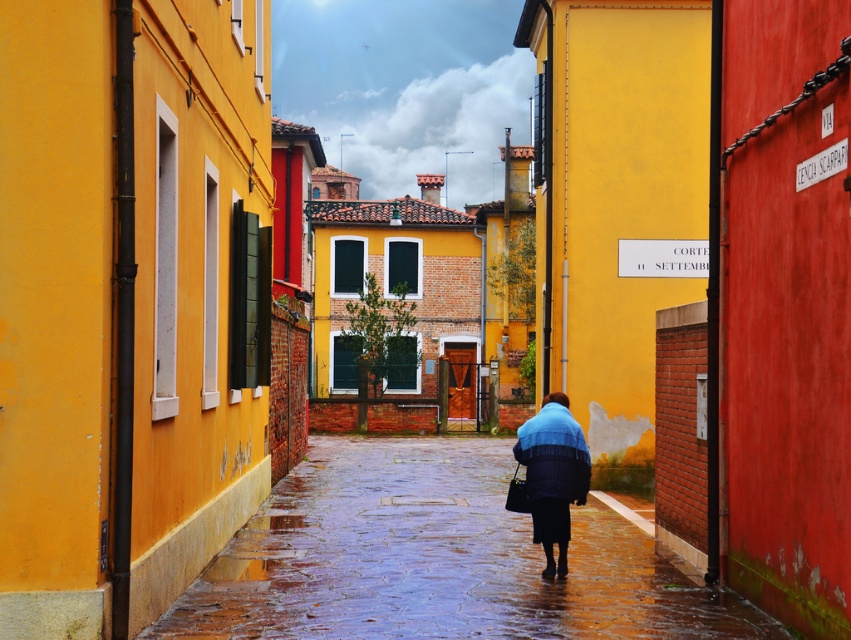
Question: Is the position of wet stone pavement at center less distant than that of blue fuzzy coat at center?

Choices:
 (A) yes
 (B) no

Answer: (A)

Question: Is wet stone pavement at center positioned behind blue fuzzy coat at center?

Choices:
 (A) yes
 (B) no

Answer: (B)

Question: Which point is closer to the camera?

Choices:
 (A) (587, 476)
 (B) (294, 634)

Answer: (B)

Question: Can you confirm if wet stone pavement at center is positioned to the left of blue fuzzy coat at center?

Choices:
 (A) yes
 (B) no

Answer: (A)

Question: Which of the following is the farthest from the observer?

Choices:
 (A) wet stone pavement at center
 (B) blue fuzzy coat at center

Answer: (B)